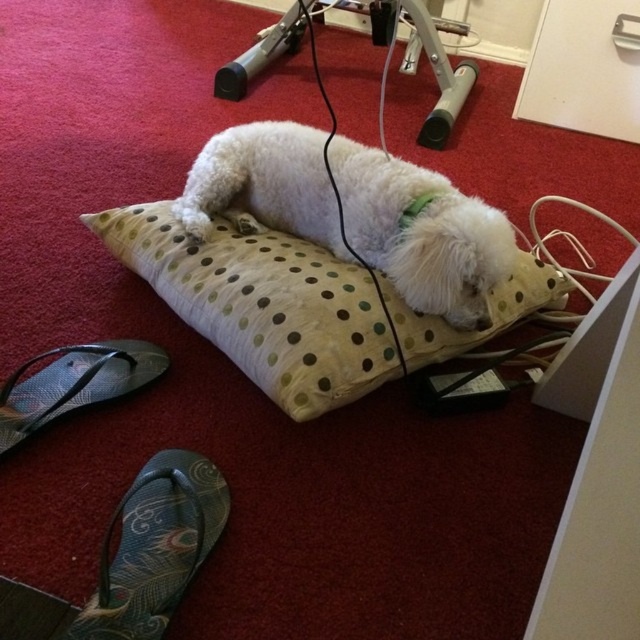
Question: Considering the real-world distances, which object is farthest from the white fluffy dog at center?

Choices:
 (A) beige dotted pillow at center
 (B) green fabric sandal at lower left

Answer: (B)

Question: Which point is farther to the camera?

Choices:
 (A) (106, 538)
 (B) (208, 232)
 (C) (323, 346)

Answer: (B)

Question: Is green fabric sandal at lower left closer to camera compared to textured fabric sandal at lower left?

Choices:
 (A) yes
 (B) no

Answer: (A)

Question: Which of the following is the closest to the observer?

Choices:
 (A) (188, 531)
 (B) (294, 275)

Answer: (A)

Question: Is beige dotted pillow at center positioned in front of green fabric sandal at lower left?

Choices:
 (A) no
 (B) yes

Answer: (A)

Question: Can you confirm if white fluffy dog at center is positioned above green fabric sandal at lower left?

Choices:
 (A) yes
 (B) no

Answer: (A)